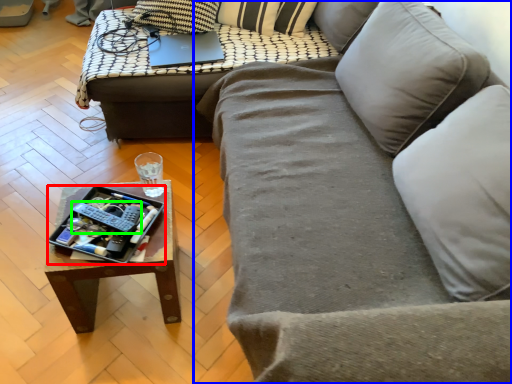
Question: Considering the real-world distances, which object is closest to tray (highlighted by a red box)? studio couch (highlighted by a blue box) or remote (highlighted by a green box).

Choices:
 (A) studio couch
 (B) remote

Answer: (B)